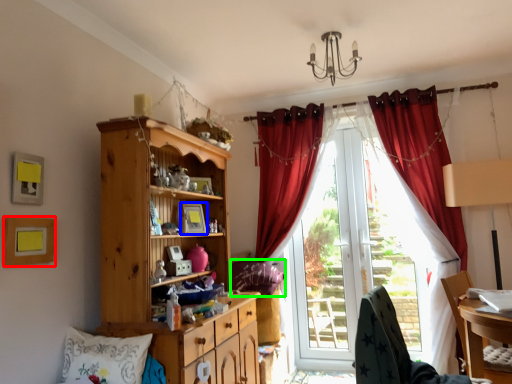
Question: Which is farther away from picture frame (highlighted by a red box)? picture frame (highlighted by a blue box) or pillow (highlighted by a green box)?

Choices:
 (A) picture frame
 (B) pillow

Answer: (B)